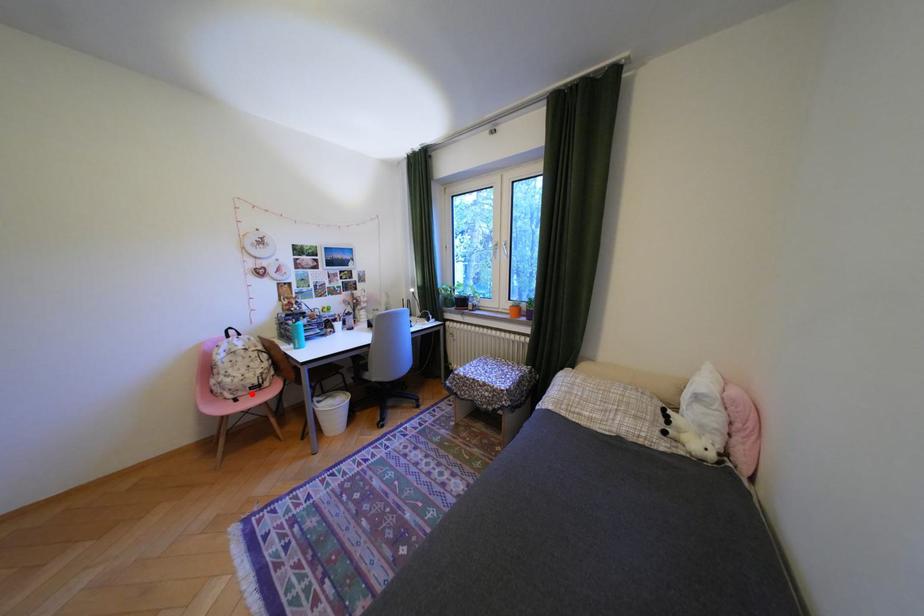
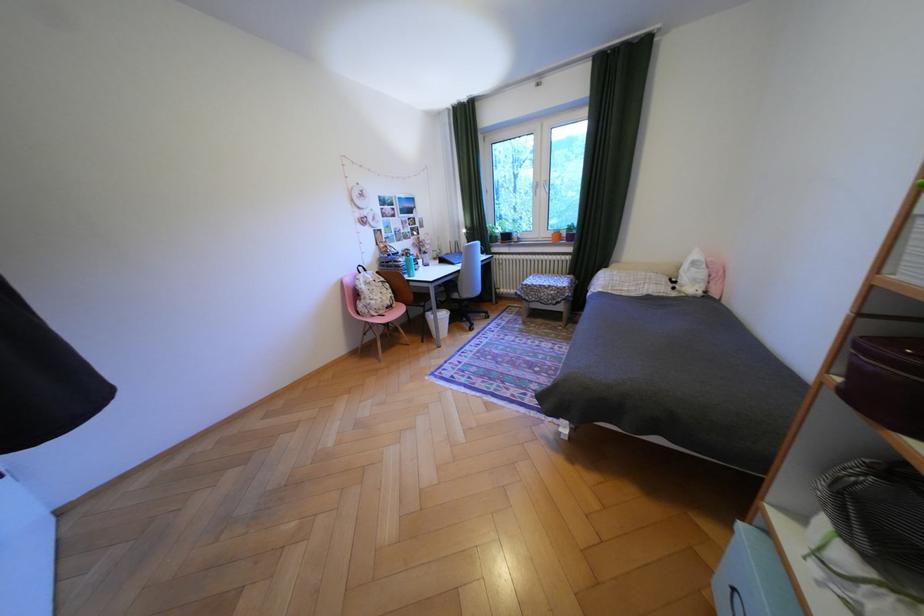
Question: I am providing you with two images of the same scene from different viewpoints. Image1 has a red point marked. In image2, the corresponding 3D location appears at what relative position? Reply with the corresponding letter.

Choices:
 (A) Closer
 (B) Farther

Answer: (A)